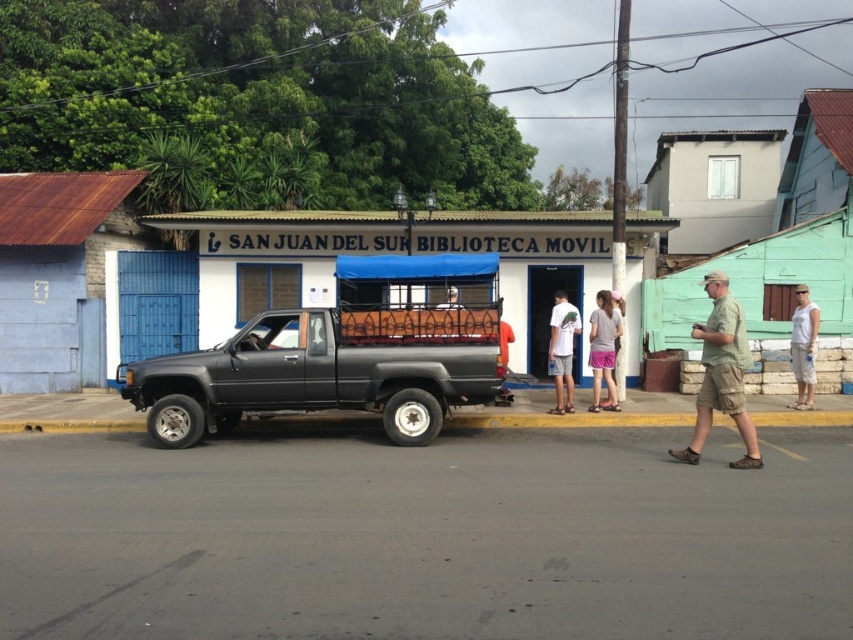
Question: Where is black matte truck at center located in relation to white cotton tank top at right in the image?

Choices:
 (A) above
 (B) below

Answer: (B)

Question: Estimate the real-world distances between objects in this image. Which object is farther from the white cotton tank top at right?

Choices:
 (A) white matte truck at center
 (B) black matte truck at center

Answer: (B)

Question: Which point is closer to the camera taking this photo?

Choices:
 (A) (561, 296)
 (B) (811, 339)
 (C) (433, 236)
 (D) (733, 332)

Answer: (D)

Question: Which of the following is the farthest from the observer?

Choices:
 (A) (599, 320)
 (B) (741, 372)
 (C) (550, 339)

Answer: (C)

Question: Does black matte truck at center appear on the right side of white cotton tank top at right?

Choices:
 (A) yes
 (B) no

Answer: (B)

Question: Does pink fabric skirt at center have a smaller size compared to white cotton tank top at right?

Choices:
 (A) yes
 (B) no

Answer: (B)